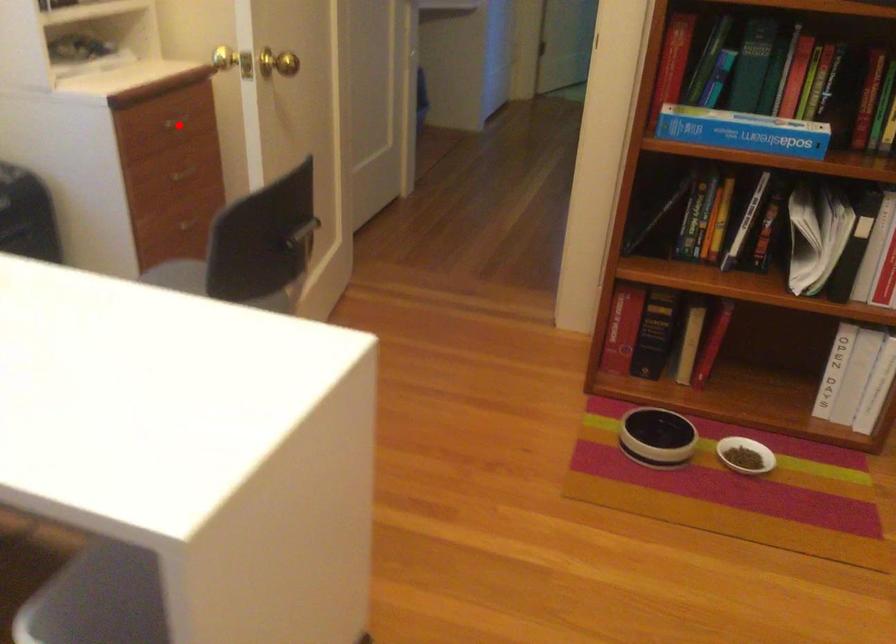
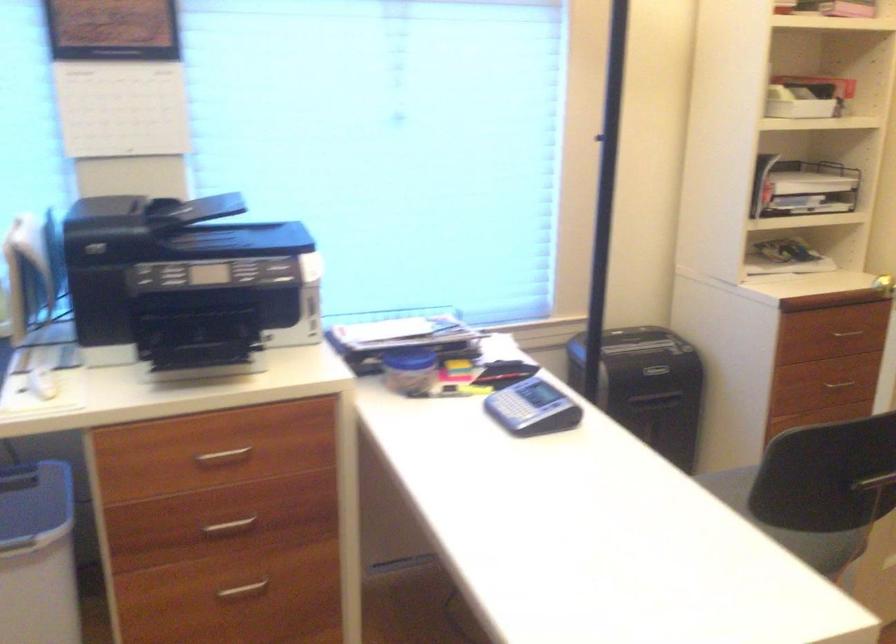
Where in the second image is the point corresponding to the highlighted location from the first image?

(847, 333)